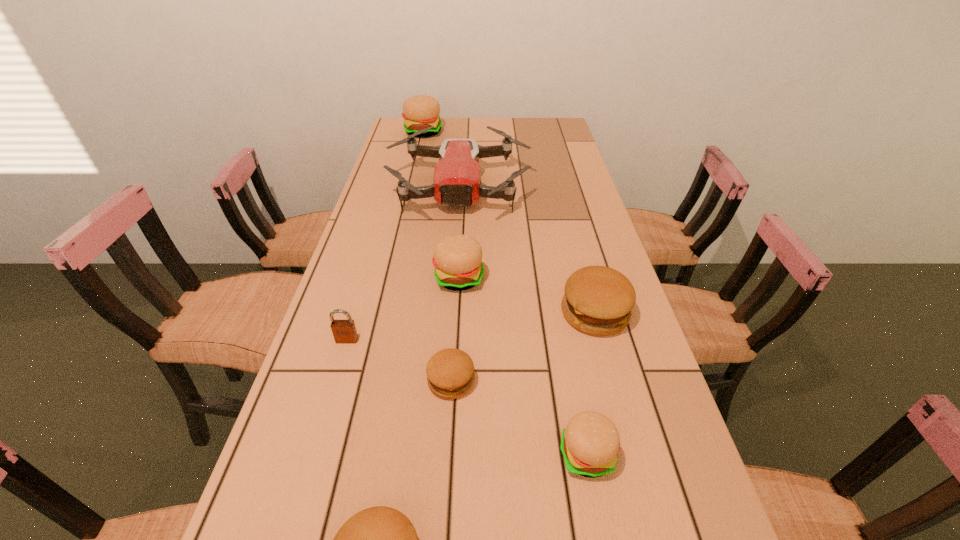
Find the location of `free space between the brown padlock and the rightmost brown hamburger`. free space between the brown padlock and the rightmost brown hamburger is located at coordinates (470, 327).

You are a GUI agent. You are given a task and a screenshot of the screen. Output one action in this format:
    pyautogui.click(x=<x>, y=<y>)
    Task: Click on the vacant space in between the farthest beige hamburger and the brown padlock
    
    Given the screenshot: What is the action you would take?
    pyautogui.click(x=385, y=236)

Identify the location of free space between the third nearest hamburger and the padlock. The image size is (960, 540). (399, 360).

Image resolution: width=960 pixels, height=540 pixels. What are the coordinates of `vacant space in between the fifth farthest hamburger and the rightmost brown hamburger` in the screenshot? It's located at (591, 384).

At what (x,y) coordinates should I click in order to perform the action: click on empty location between the biggest brown hamburger and the rightmost beige hamburger. Please return your answer as a coordinate pair (x, y). This screenshot has height=540, width=960. Looking at the image, I should click on (591, 384).

You are a GUI agent. You are given a task and a screenshot of the screen. Output one action in this format:
    pyautogui.click(x=<x>, y=<y>)
    Task: Click on the empty space between the rightmost beige hamburger and the smallest brown hamburger
    This screenshot has height=540, width=960.
    Given the screenshot: What is the action you would take?
    pyautogui.click(x=519, y=418)

The width and height of the screenshot is (960, 540). I want to click on object that stands as the fourth closest to the smallest beige hamburger, so click(457, 258).

Choose which object is the fourth nearest neighbor to the brown padlock. Please provide its 2D coordinates. Your answer should be formatted as a tuple, i.e. [(x, y)], where the tuple contains the x and y coordinates of a point satisfying the conditions above.

[(456, 182)]

The image size is (960, 540). I want to click on hamburger object that ranks as the second closest to the shortest hamburger, so click(x=457, y=258).

Locate an element on the screen. the fifth closest hamburger to the farthest object is located at coordinates (380, 539).